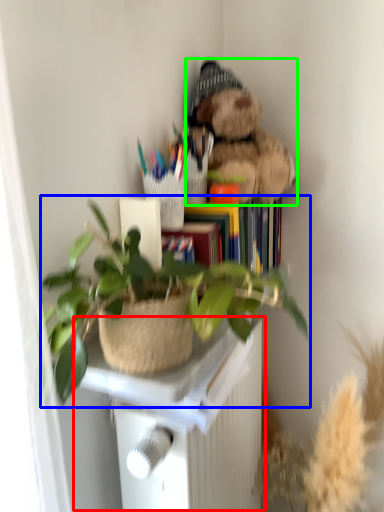
Question: Based on their relative distances, which object is farther from table (highlighted by a red box)? Choose from houseplant (highlighted by a blue box) and teddy bear (highlighted by a green box).

Choices:
 (A) houseplant
 (B) teddy bear

Answer: (B)